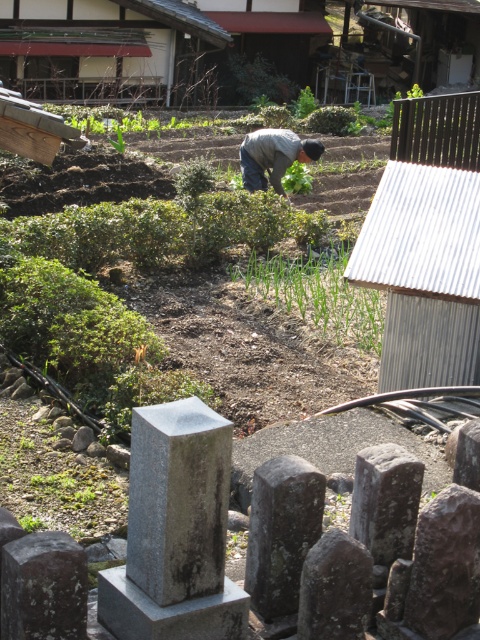
Is point (44, 56) closer to viewer compared to point (269, 161)?

No, it is behind (269, 161).

This screenshot has height=640, width=480. Identify the location of wooden hut at upper center. (96, 48).

Is point (143, 4) more distant than point (300, 145)?

Yes, point (143, 4) is behind point (300, 145).

Locate an element on the screen. This screenshot has height=640, width=480. wooden hut at upper center is located at coordinates (96, 48).